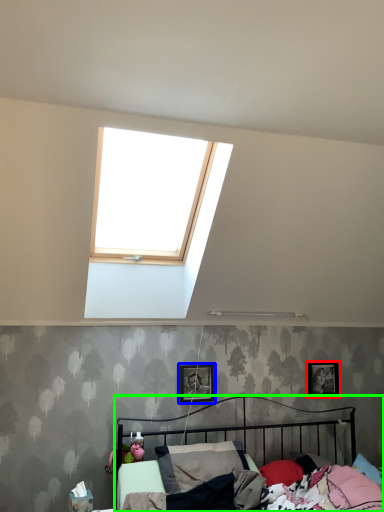
Question: Which is nearer to the picture frame (highlighted by a red box)? picture frame (highlighted by a blue box) or bed (highlighted by a green box).

Choices:
 (A) picture frame
 (B) bed

Answer: (B)